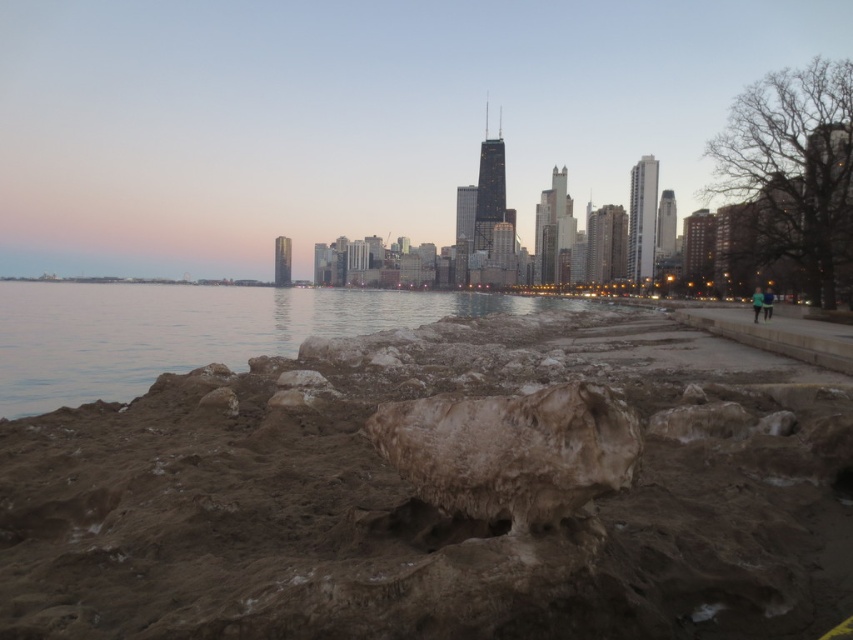
Can you confirm if brown muddy rock at lower center is positioned to the right of brown rough stone at center?

Indeed, brown muddy rock at lower center is positioned on the right side of brown rough stone at center.

Between brown muddy rock at lower center and brown rough stone at center, which one appears on the right side from the viewer's perspective?

brown muddy rock at lower center

Is point (393, 496) less distant than point (479, 456)?

No, it is behind (479, 456).

Locate an element on the screen. Image resolution: width=853 pixels, height=640 pixels. brown muddy rock at lower center is located at coordinates (433, 499).

Who is taller, brown muddy rock at lower center or clear water at lower left?

With more height is clear water at lower left.

Is brown muddy rock at lower center above clear water at lower left?

No.

Between point (192, 486) and point (27, 403), which one is positioned behind?

The point (27, 403) is behind.

This screenshot has height=640, width=853. Identify the location of brown muddy rock at lower center. (433, 499).

Does clear water at lower left appear over brown rough stone at center?

Indeed, clear water at lower left is positioned over brown rough stone at center.

Describe the element at coordinates (190, 330) in the screenshot. I see `clear water at lower left` at that location.

Locate an element on the screen. This screenshot has height=640, width=853. clear water at lower left is located at coordinates (190, 330).